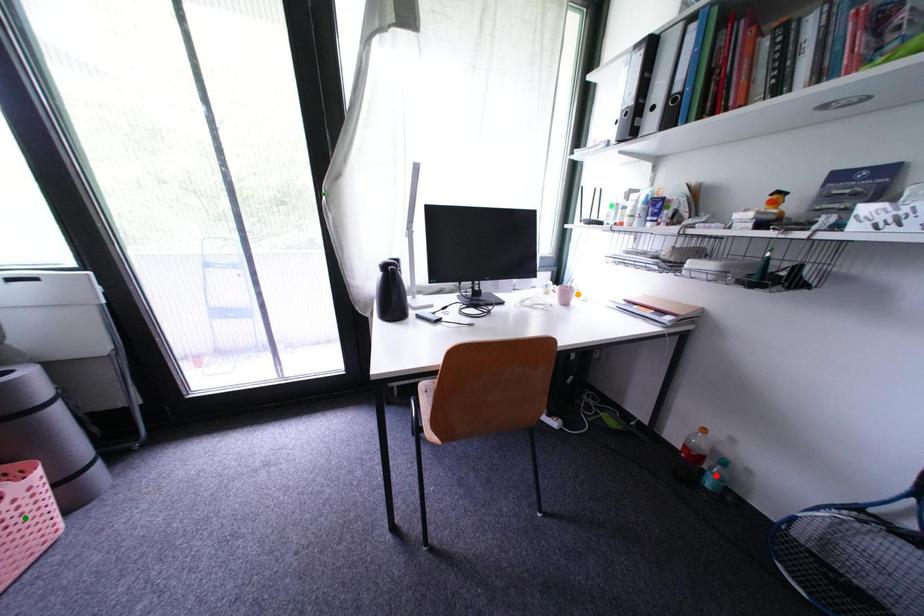
Order these from nearest to farthest:
green point | orange point | red point

orange point
red point
green point